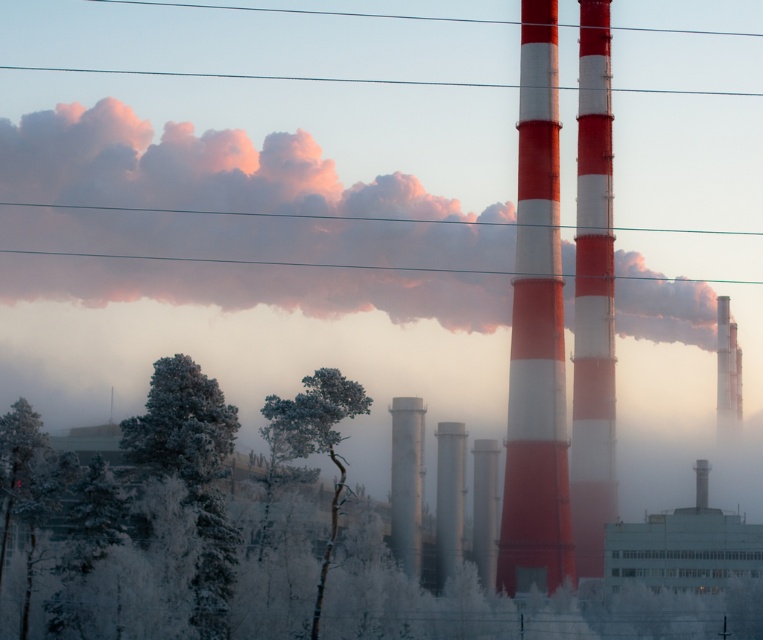
Does frosted pine tree at left lie behind smooth metallic pipe at center?

No, frosted pine tree at left is in front of smooth metallic pipe at center.

Is frosted pine tree at left thinner than smooth metallic pipe at center?

No, frosted pine tree at left is not thinner than smooth metallic pipe at center.

You are a GUI agent. You are given a task and a screenshot of the screen. Output one action in this format:
    pyautogui.click(x=<x>, y=<y>)
    Task: Click on the frosted pine tree at left
    
    Given the screenshot: What is the action you would take?
    pyautogui.click(x=24, y=483)

Is smooth metallic pipe at center taller than smooth gray smokestack at right?

Incorrect, smooth metallic pipe at center's height is not larger of smooth gray smokestack at right's.

How much distance is there between smooth metallic pipe at center and smooth gray smokestack at right?

A distance of 39.04 meters exists between smooth metallic pipe at center and smooth gray smokestack at right.

The width and height of the screenshot is (763, 640). I want to click on smooth metallic pipe at center, so click(485, 509).

Is the position of frosty white tree at center less distant than that of white smooth chimney at center?

Yes, it is.

Can you confirm if frosty white tree at center is shorter than white smooth chimney at center?

No.

Does point (301, 436) come closer to viewer compared to point (697, 502)?

Yes, point (301, 436) is closer to viewer.

Locate an element on the screen. frosty white tree at center is located at coordinates point(314,436).